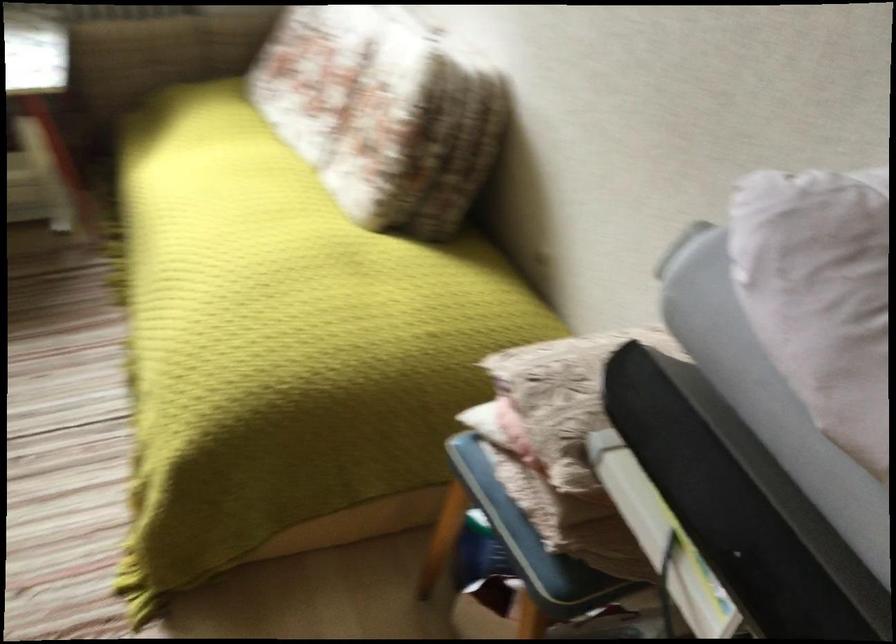
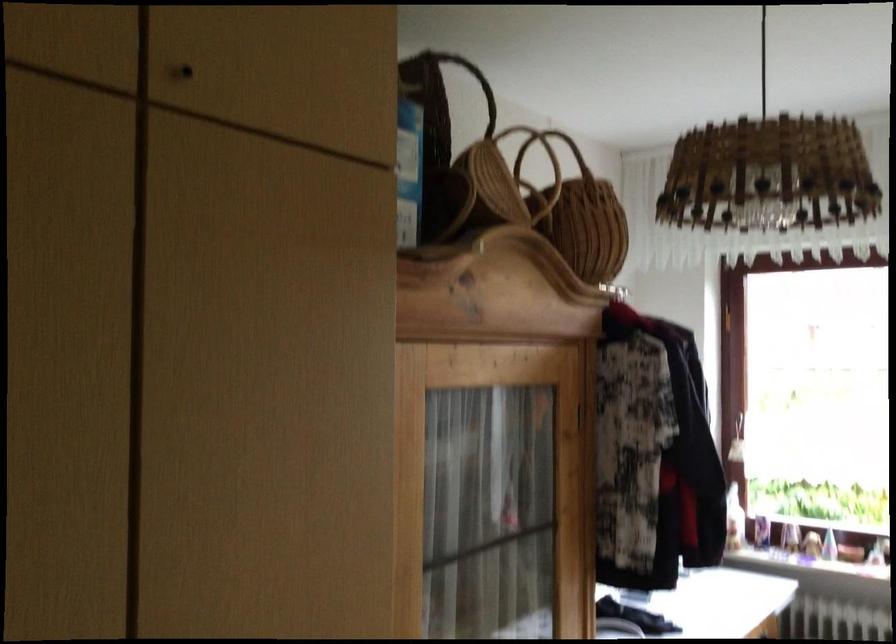
The images are taken continuously from a first-person perspective. In which direction is your viewpoint rotating?

The rotation direction of the camera is left-up.